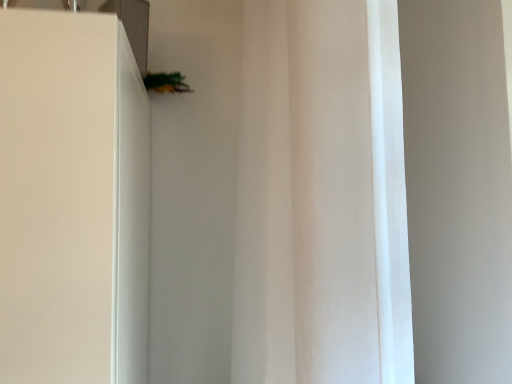
This screenshot has width=512, height=384. Describe the element at coordinates (321, 197) in the screenshot. I see `white fabric curtain at center` at that location.

The image size is (512, 384). What are the coordinates of `white fabric curtain at center` in the screenshot? It's located at (321, 197).

Where is `white fabric curtain at center`? white fabric curtain at center is located at coordinates (321, 197).